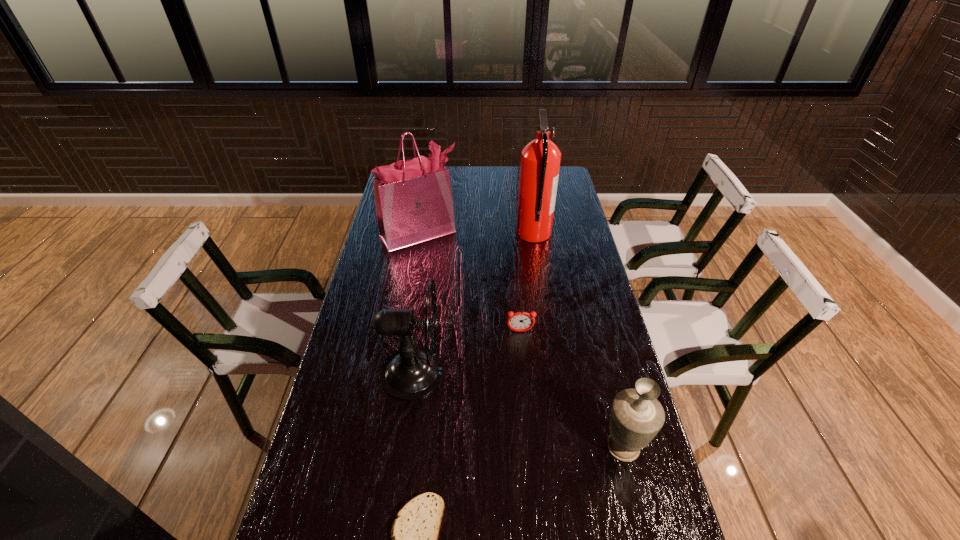
Locate an element on the screen. The image size is (960, 540). free point that satisfies the following two spatial constraints: 1. at the nozzle of the fire extinguisher; 2. on the front-facing side of the second shortest object is located at coordinates (548, 332).

The height and width of the screenshot is (540, 960). I want to click on vacant space that satisfies the following two spatial constraints: 1. at the nozzle of the fire extinguisher; 2. on the front-facing side of the fifth tallest object, so click(x=548, y=332).